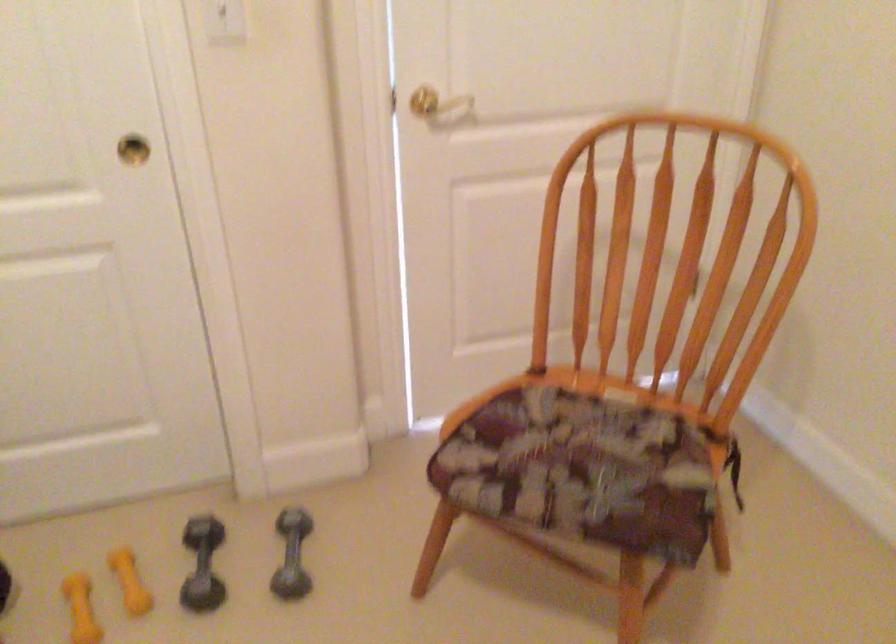
Find where to push the white light switch. Please return your answer as a coordinate pair (x, y).

(222, 8)